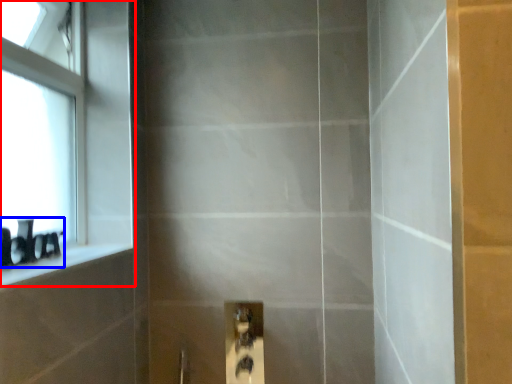
Question: Which of the following is the farthest to the observer, window (highlighted by a red box) or toiletry (highlighted by a blue box)?

Choices:
 (A) window
 (B) toiletry

Answer: (A)